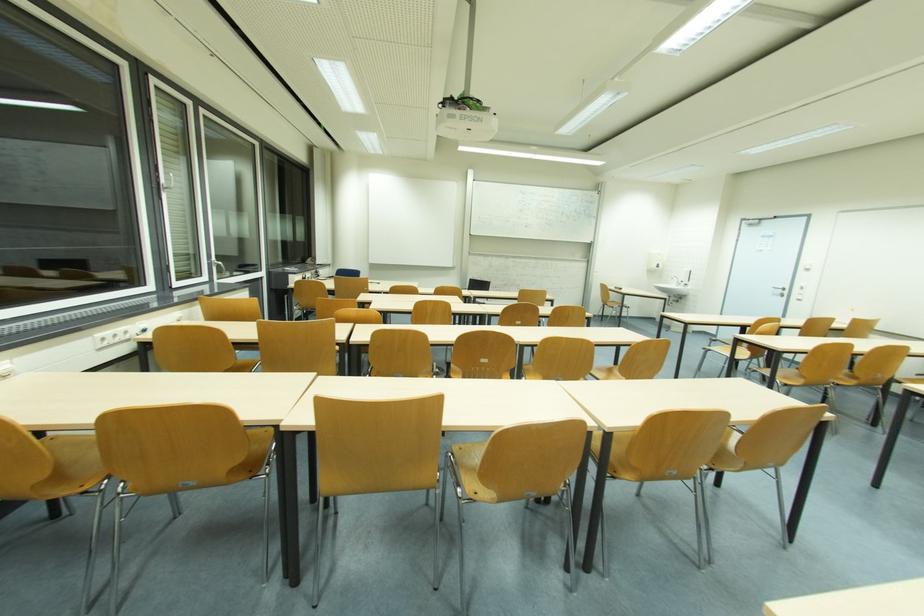
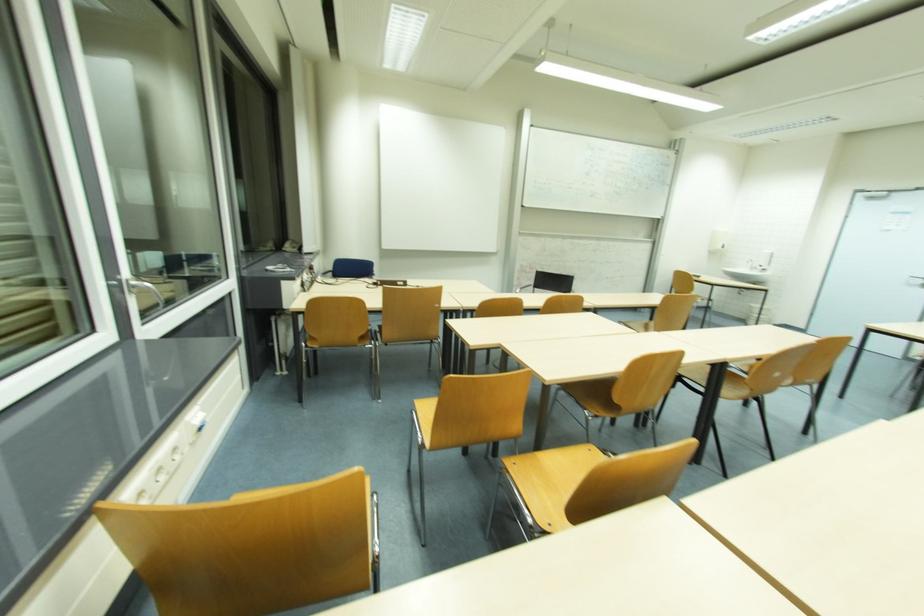
Which direction would the cameraman need to move to produce the second image?

The cameraman moved toward left, forward.